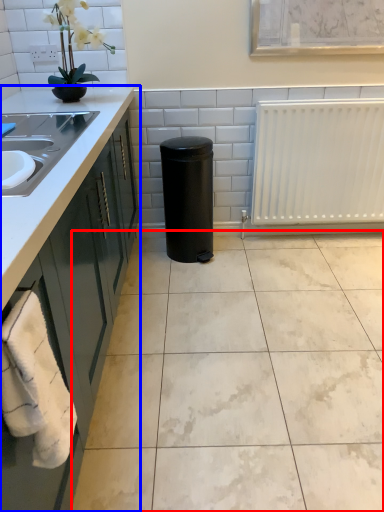
Question: Which point is closer to the camera, ceramic tile (highlighted by a red box) or countertop (highlighted by a blue box)?

Choices:
 (A) ceramic tile
 (B) countertop

Answer: (B)